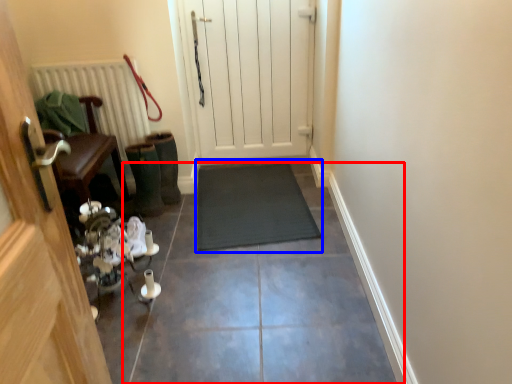
Question: Which object appears closest to the camera in this image, path (highlighted by a red box) or doormat (highlighted by a blue box)?

Choices:
 (A) path
 (B) doormat

Answer: (A)